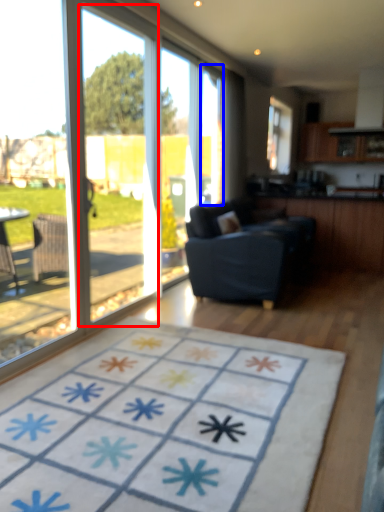
Question: Which point is closer to the camera, screen door (highlighted by a red box) or window screen (highlighted by a blue box)?

Choices:
 (A) screen door
 (B) window screen

Answer: (A)